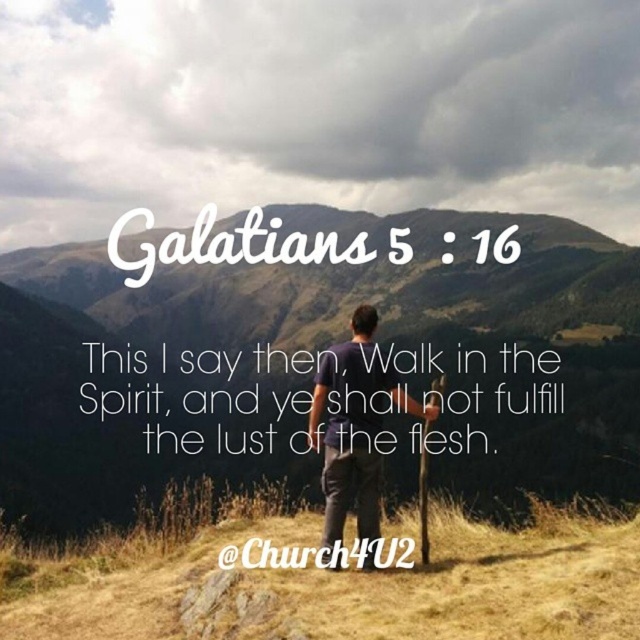
You are a hiker standing at the base of the mountain range. You see the brown grassy hill at center. In which direction should you head to reach the mountain range?

The brown grassy hill at center is located at point (316, 358), which is near the center of the image. Since the mountain range dominates the background, you should head towards the direction where the mountains are visible, likely straight ahead or uphill from the hill.